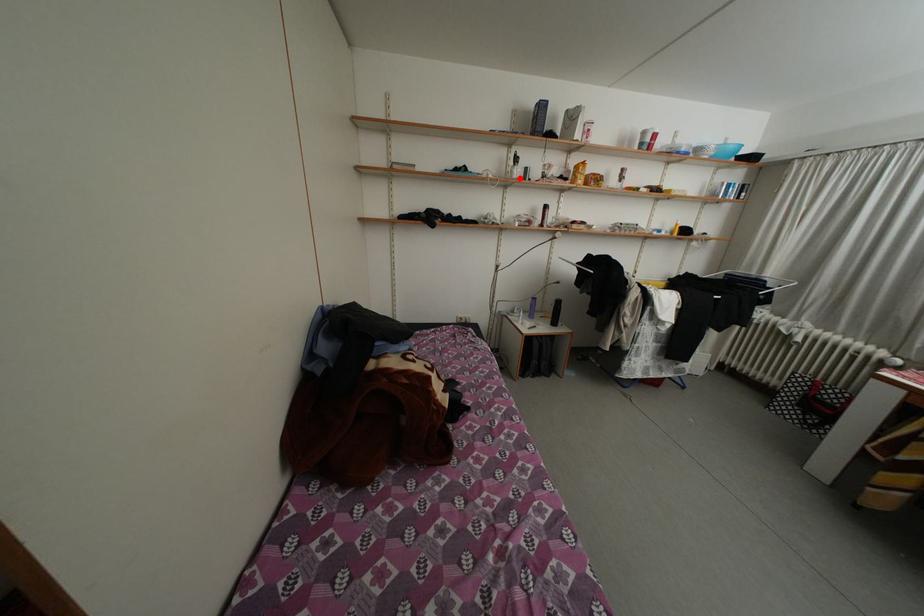
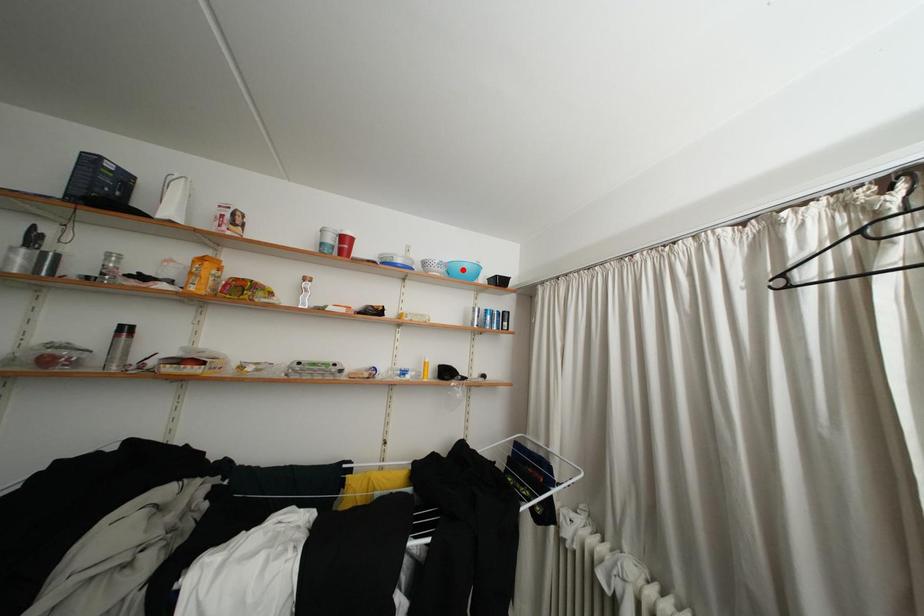
I am providing you with two images of the same scene from different viewpoints. A red point is marked on the first image and another point is marked on the second image. Is the marked point in image1 the same physical position as the marked point in image2?

No